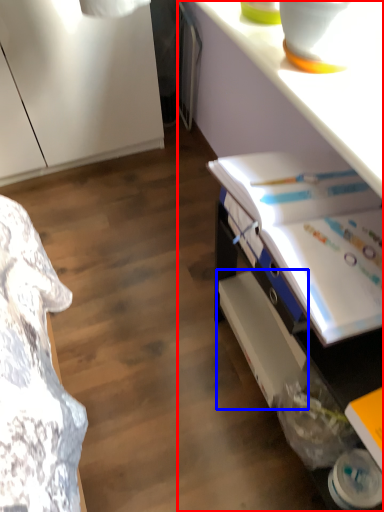
Question: Among these objects, which one is nearest to the camera, desk (highlighted by a red box) or shelf (highlighted by a blue box)?

Choices:
 (A) desk
 (B) shelf

Answer: (A)